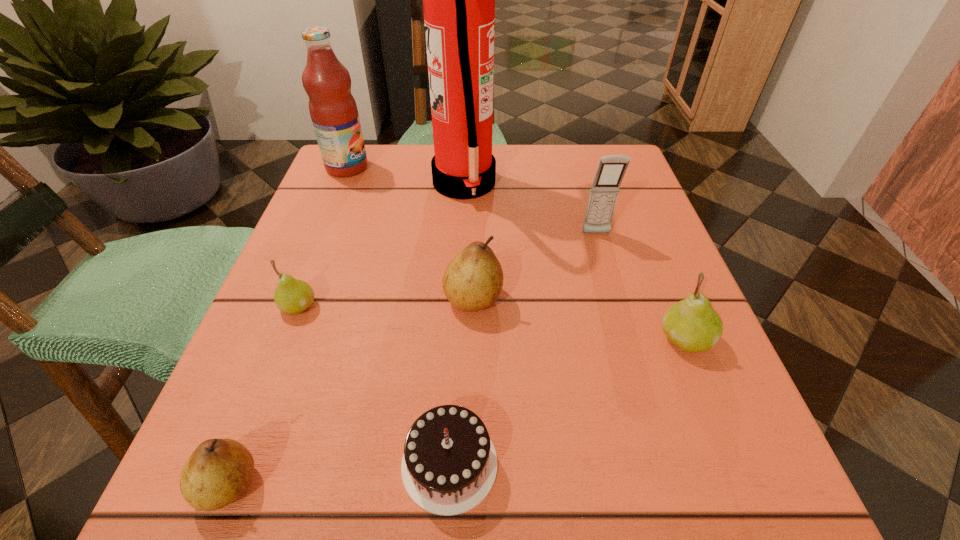
Image resolution: width=960 pixels, height=540 pixels. I want to click on vacant area situated on the back of the chocolate cake, so click(x=458, y=289).

This screenshot has height=540, width=960. I want to click on fire extinguisher at the far edge, so coord(458,0).

This screenshot has width=960, height=540. Find the location of `fruit juice that is positioned at the far edge`. fruit juice that is positioned at the far edge is located at coordinates (333, 110).

In order to click on pear present at the near edge in this screenshot , I will do `click(218, 472)`.

Identify the location of chocolate cake present at the near edge. This screenshot has width=960, height=540. (449, 465).

I want to click on fruit juice that is at the left edge, so click(333, 110).

Identify the location of cellular telephone that is at the right edge. (611, 169).

This screenshot has width=960, height=540. I want to click on pear present at the right edge, so (692, 325).

Image resolution: width=960 pixels, height=540 pixels. Find the location of `object that is at the far left corner`. object that is at the far left corner is located at coordinates (333, 110).

Image resolution: width=960 pixels, height=540 pixels. I want to click on object situated at the near left corner, so click(218, 472).